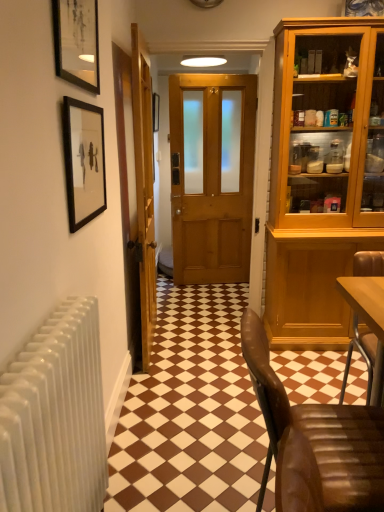
Find the location of a particular element. This screenshot has width=384, height=512. free space that is to the left of wooden door at center, positioned as the 2th door in left-to-right order is located at coordinates (178, 316).